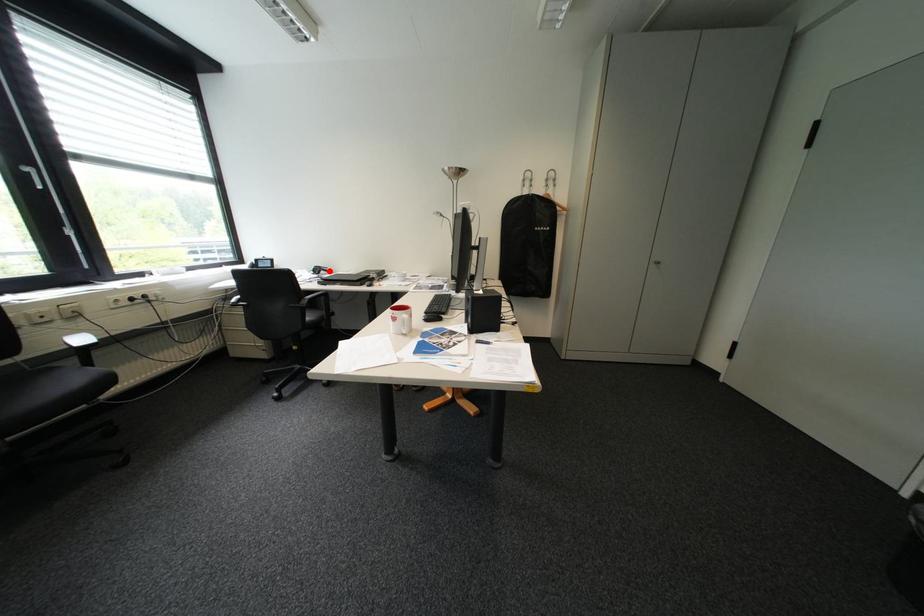
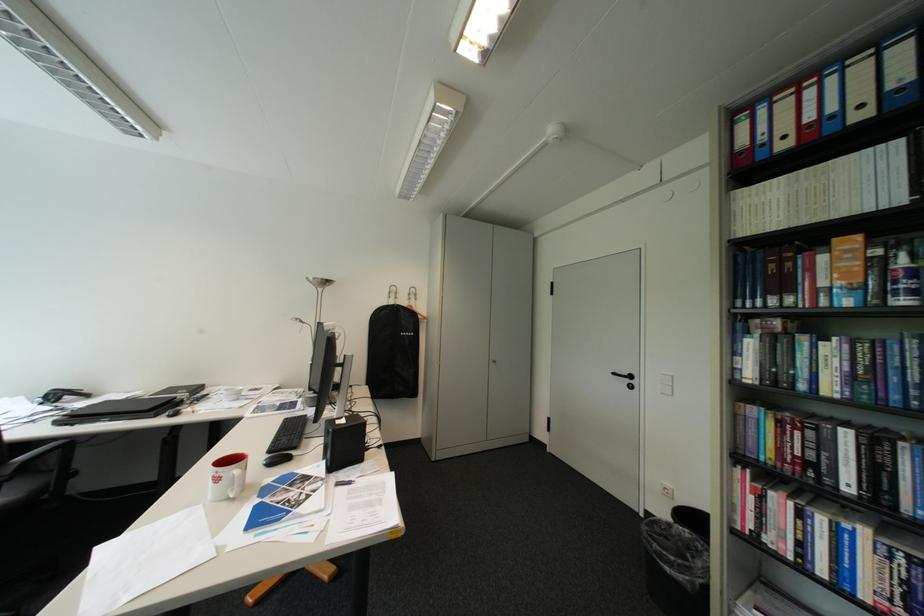
In the second image, find the point that corresponds to the highlighted location in the first image.

(67, 397)